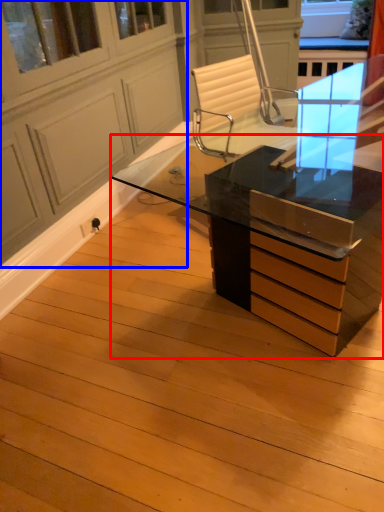
Question: Among these objects, which one is farthest to the camera, desk (highlighted by a red box) or screen door (highlighted by a blue box)?

Choices:
 (A) desk
 (B) screen door

Answer: (A)